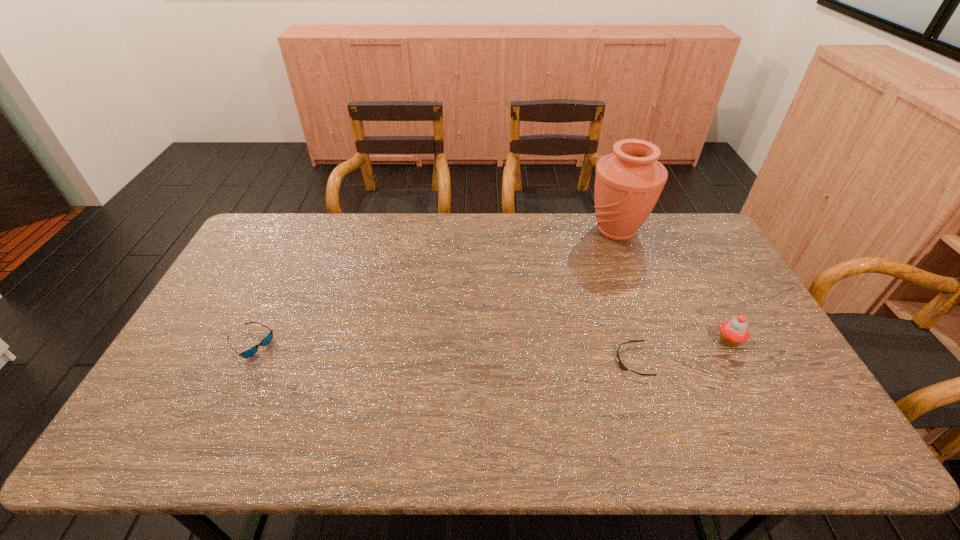
This screenshot has width=960, height=540. I want to click on empty location between the left sunglasses and the shortest object, so click(442, 353).

Locate an element on the screen. The height and width of the screenshot is (540, 960). object that can be found as the second closest to the leftmost object is located at coordinates (628, 183).

Identify which object is located as the third nearest to the leftmost object. Please provide its 2D coordinates. Your answer should be formatted as a tuple, i.e. [(x, y)], where the tuple contains the x and y coordinates of a point satisfying the conditions above.

[(734, 332)]

Locate an element on the screen. vacant space that satisfies the following two spatial constraints: 1. on the front side of the farthest object; 2. on the front-facing side of the shortest object is located at coordinates [664, 361].

Locate an element on the screen. This screenshot has width=960, height=540. free space that satisfies the following two spatial constraints: 1. on the front side of the vase; 2. at the front of the left sunglasses showing the lenses is located at coordinates pyautogui.click(x=659, y=344).